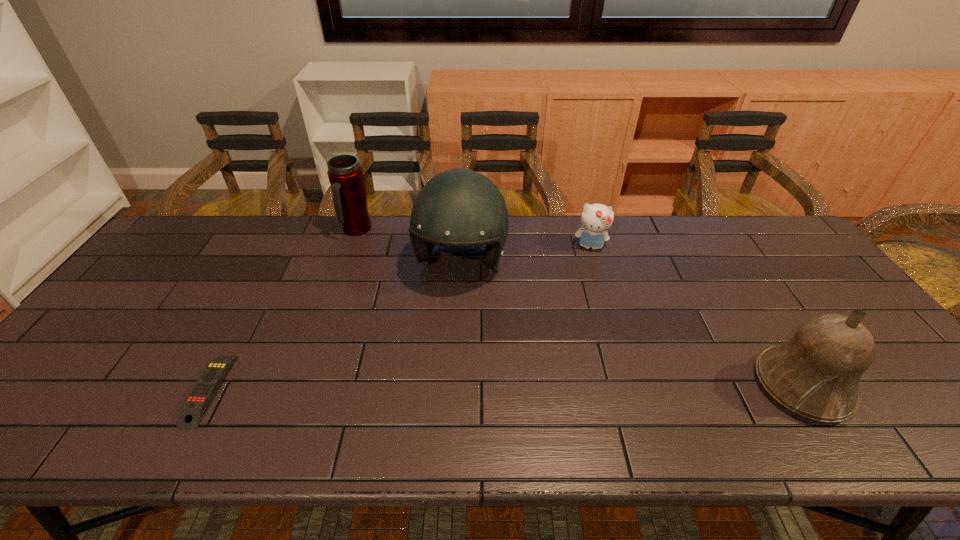
Find the location of `thermos bottle that is at the far edge`. thermos bottle that is at the far edge is located at coordinates (345, 174).

The width and height of the screenshot is (960, 540). In order to click on kitten that is at the far edge in this screenshot , I will do `click(596, 219)`.

Locate an element on the screen. Image resolution: width=960 pixels, height=540 pixels. remote control located at the near edge is located at coordinates (x=191, y=412).

This screenshot has width=960, height=540. Identify the location of bell that is at the near edge. [815, 374].

The image size is (960, 540). In the image, there is a desktop. In order to click on blank space at the far edge in this screenshot , I will do `click(675, 259)`.

In the image, there is a desktop. Where is `vacant space at the near edge`? The image size is (960, 540). vacant space at the near edge is located at coordinates (590, 400).

Image resolution: width=960 pixels, height=540 pixels. In the image, there is a desktop. Find the location of `free region at the left edge`. free region at the left edge is located at coordinates pos(171,271).

This screenshot has width=960, height=540. In order to click on free space at the right edge in this screenshot , I will do `click(772, 279)`.

The image size is (960, 540). Find the location of `free region at the far right corner of the desktop`. free region at the far right corner of the desktop is located at coordinates (731, 217).

Locate an element on the screen. vacant area that lies between the remote control and the kitten is located at coordinates (399, 318).